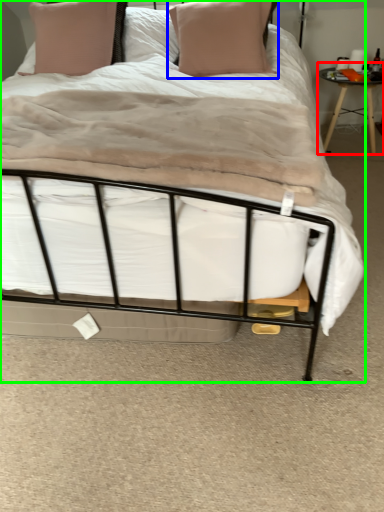
Question: Based on their relative distances, which object is farther from table (highlighted by a red box)? Choose from pillow (highlighted by a blue box) and bed (highlighted by a green box).

Choices:
 (A) pillow
 (B) bed

Answer: (B)